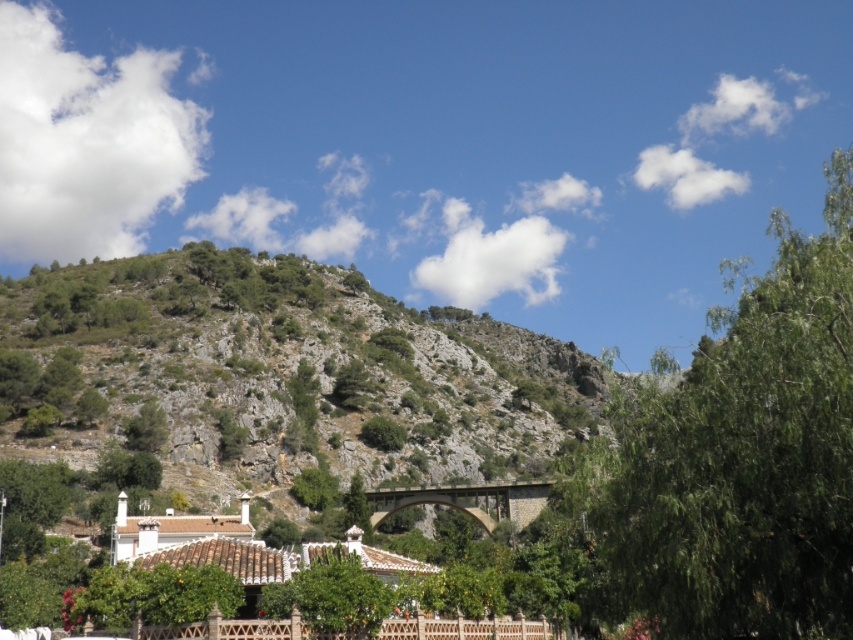
Who is higher up, green rocky hillside at upper left or green leafy tree at center?

green rocky hillside at upper left is above.

Between point (538, 433) and point (306, 602), which one is positioned in front?

Point (306, 602)

The width and height of the screenshot is (853, 640). What do you see at coordinates (293, 371) in the screenshot?
I see `green rocky hillside at upper left` at bounding box center [293, 371].

At what (x,y) coordinates should I click in order to perform the action: click on green rocky hillside at upper left. Please return your answer as a coordinate pair (x, y). Looking at the image, I should click on (293, 371).

Can you confirm if green rocky hillside at upper left is shorter than green leafy tree at upper right?

No, green rocky hillside at upper left is not shorter than green leafy tree at upper right.

Is green rocky hillside at upper left to the left of green leafy tree at upper right from the viewer's perspective?

Yes, green rocky hillside at upper left is to the left of green leafy tree at upper right.

Describe the element at coordinates (293, 371) in the screenshot. I see `green rocky hillside at upper left` at that location.

Locate an element on the screen. green rocky hillside at upper left is located at coordinates (293, 371).

Who is lower down, green leafy tree at upper right or green leafy tree at center?

green leafy tree at center

Between green leafy tree at upper right and green leafy tree at center, which one has less height?

With less height is green leafy tree at center.

This screenshot has height=640, width=853. I want to click on green leafy tree at upper right, so click(x=740, y=458).